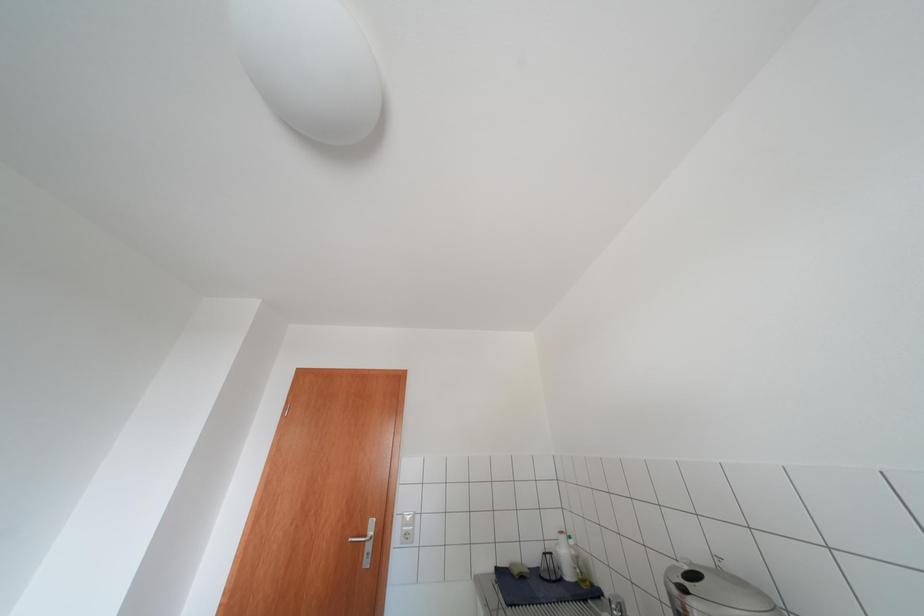
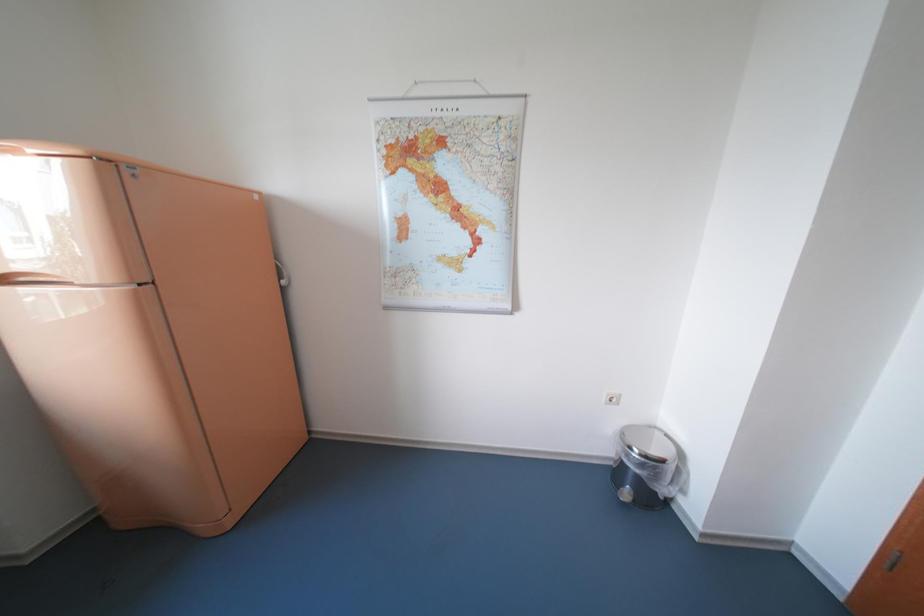
Question: How did the camera likely rotate?

Choices:
 (A) Left
 (B) Right
 (C) Up
 (D) Down

Answer: (A)